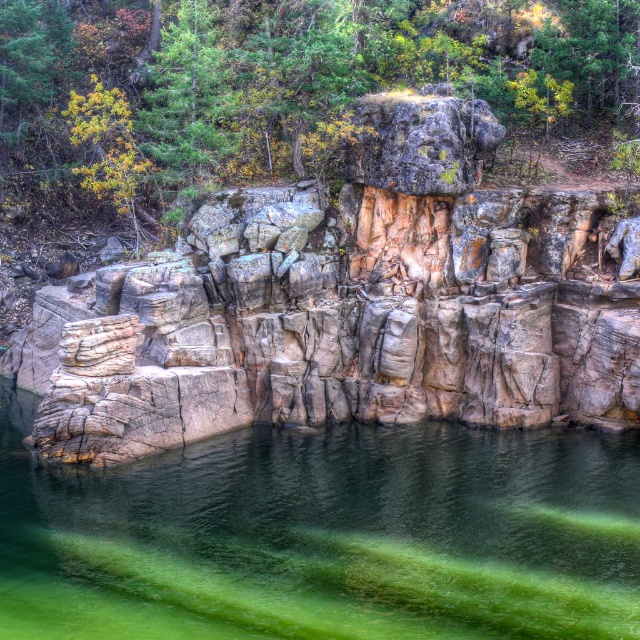
Which is more to the left, rustic stone cliff at center or green leafy tree at upper center?

green leafy tree at upper center is more to the left.

Based on the photo, can you confirm if rustic stone cliff at center is positioned above green leafy tree at upper center?

No.

Measure the distance between point (202, 262) and camera.

Point (202, 262) and camera are 32.65 meters apart.

I want to click on rustic stone cliff at center, so click(348, 305).

Is green translucent water at center thinner than green leafy tree at upper center?

Indeed, green translucent water at center has a lesser width compared to green leafy tree at upper center.

Who is more forward, (358, 518) or (380, 35)?

Point (358, 518)

The image size is (640, 640). Identify the location of green translucent water at center. (324, 536).

Can you confirm if rustic stone cliff at center is taller than green translucent water at center?

Yes, rustic stone cliff at center is taller than green translucent water at center.

Can you confirm if rustic stone cliff at center is shorter than green translucent water at center?

No, rustic stone cliff at center is not shorter than green translucent water at center.

At what (x,y) coordinates should I click in order to perform the action: click on rustic stone cliff at center. Please return your answer as a coordinate pair (x, y). Image resolution: width=640 pixels, height=640 pixels. Looking at the image, I should click on (348, 305).

Find the location of a particular element. rustic stone cliff at center is located at coordinates (348, 305).